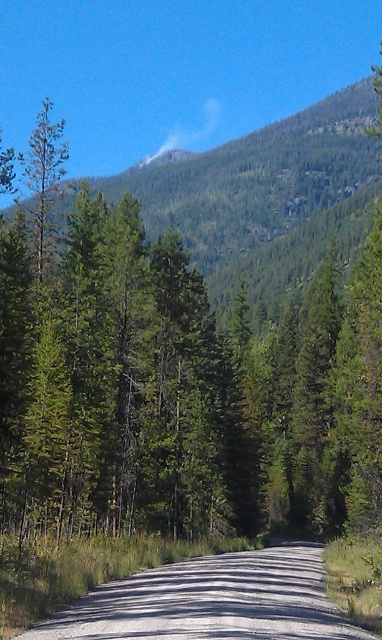
You are a hiker planning to reach the green forested mountain at upper center. The trail you are on is 300 feet long. Will you be able to reach the mountain from your current position?

The distance between you and the green forested mountain at upper center is 398.82 feet, which is longer than the 300 feet trail available. Therefore, you will not be able to reach the mountain from your current position with the available trail length.

You are a hiker planning to take the gray gravel road at center to reach the green forested mountain at upper center. Based on the scene, what direction should you head to move from the road towards the mountain?

The green forested mountain at upper center is located above the gray gravel road at center, so you should head upwards to move from the road towards the mountain.